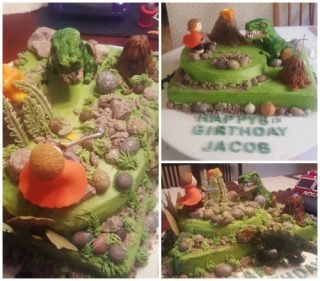
I want to click on white tablecloth, so click(x=312, y=39).